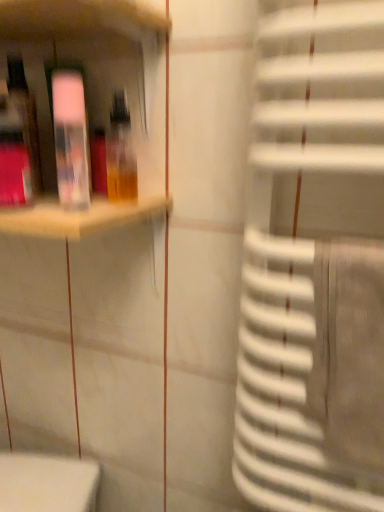
Question: Considering the positions of transparent plastic bottle at upper left, the 2th bottle in the right-to-left sequence, and matte plastic shelf at upper left in the image, is transparent plastic bottle at upper left, the 2th bottle in the right-to-left sequence, bigger or smaller than matte plastic shelf at upper left?

Choices:
 (A) small
 (B) big

Answer: (A)

Question: From the image's perspective, is transparent plastic bottle at upper left, the 2th bottle in the right-to-left sequence, located above or below matte plastic shelf at upper left?

Choices:
 (A) above
 (B) below

Answer: (B)

Question: Based on their relative distances, which object is farther from the matte plastic shelf at upper left?

Choices:
 (A) transparent plastic bottle at upper left, the 2th bottle in the right-to-left sequence
 (B) translucent plastic bottle at upper left, placed as the second bottle when sorted from left to right

Answer: (B)

Question: Which is nearer to the matte plastic shelf at upper left?

Choices:
 (A) translucent plastic bottle at upper left, the first bottle viewed from the right
 (B) transparent plastic bottle at upper left, placed as the 1th bottle when sorted from left to right

Answer: (B)